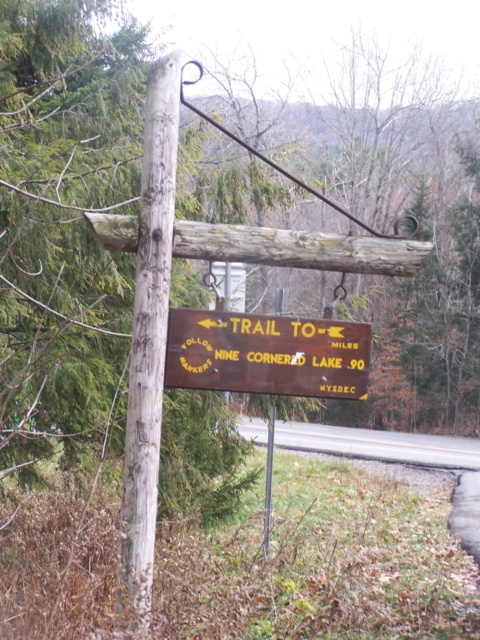
Which is below, weathered wood pole at center or brown wooden sign at center?

brown wooden sign at center is below.

Does weathered wood pole at center have a lesser height compared to brown wooden sign at center?

Incorrect, weathered wood pole at center's height does not fall short of brown wooden sign at center's.

Between point (153, 108) and point (287, 368), which one is positioned in front?

Point (153, 108) is more forward.

Locate an element on the screen. The height and width of the screenshot is (640, 480). weathered wood pole at center is located at coordinates (148, 342).